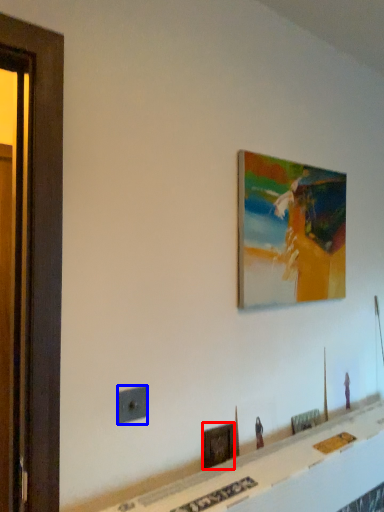
Question: Which object appears farthest to the camera in this image, picture frame (highlighted by a red box) or electric outlet (highlighted by a blue box)?

Choices:
 (A) picture frame
 (B) electric outlet

Answer: (A)